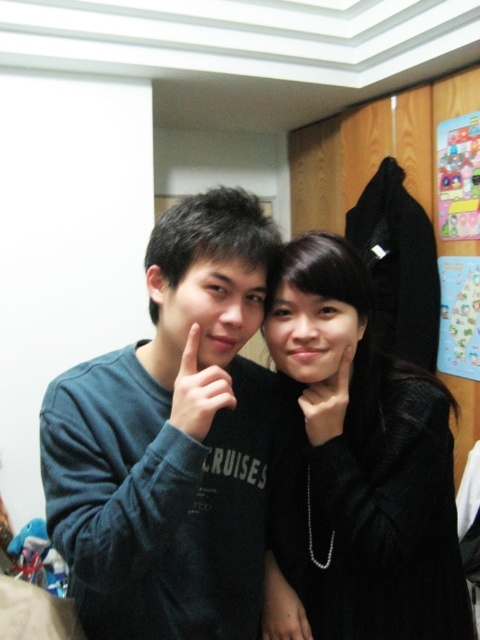
You are a photographer setting up for a portrait. You notice the black matte coat at center and the black matte hand at center in the scene. To ensure the hand appears to be interacting with the coat in the photo, what is the minimum distance you should maintain between them in centimeters?

The minimum distance you should maintain between the black matte coat at center and the black matte hand at center is 14.04 centimeters to ensure the hand appears to be interacting with the coat in the photo.

You are standing in the room and want to place a new picture frame on the wall. The picture frame requires a hook that must be placed exactly at the center of the wall. The wall is 3 meters wide. The black matte coat at center is currently hanging at coordinates point 0.716, 0.762. Can you determine if the coat is already positioned at the center of the wall?

The black matte coat at center is located at point (x=365, y=458). Since the wall is 3 meters wide, the exact center would be at 1.5 meters from either side. However, the coordinates provided do not directly translate to meters, so we cannot confirm if the coat is at the center without additional information about the coordinate system used.